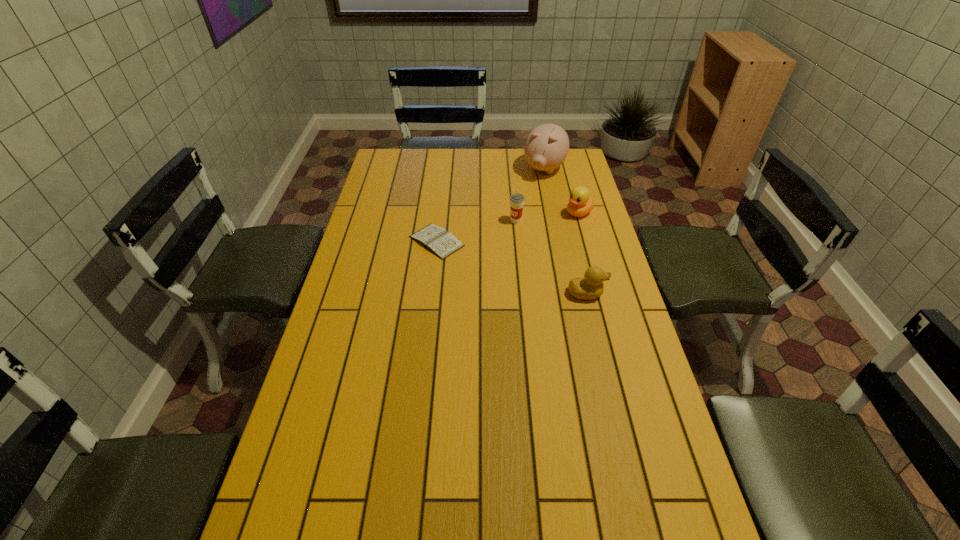
You are a GUI agent. You are given a task and a screenshot of the screen. Output one action in this format:
    pyautogui.click(x=<x>, y=<y>)
    Task: Click on the vacant space on the desktop that is between the shortest object and the nearer duckling and is positioned on the side of the cup with the logo
    
    Given the screenshot: What is the action you would take?
    pyautogui.click(x=491, y=260)

At what (x,y) coordinates should I click in order to perform the action: click on vacant space on the desktop that is between the diary and the nearer duckling and is positioned on the face of the farther duckling. Please return your answer as a coordinate pair (x, y). Image resolution: width=960 pixels, height=540 pixels. Looking at the image, I should click on (502, 264).

The height and width of the screenshot is (540, 960). I want to click on vacant space on the desktop that is between the leftmost object and the nearest object and is positioned at the snout of the tallest object, so click(x=486, y=258).